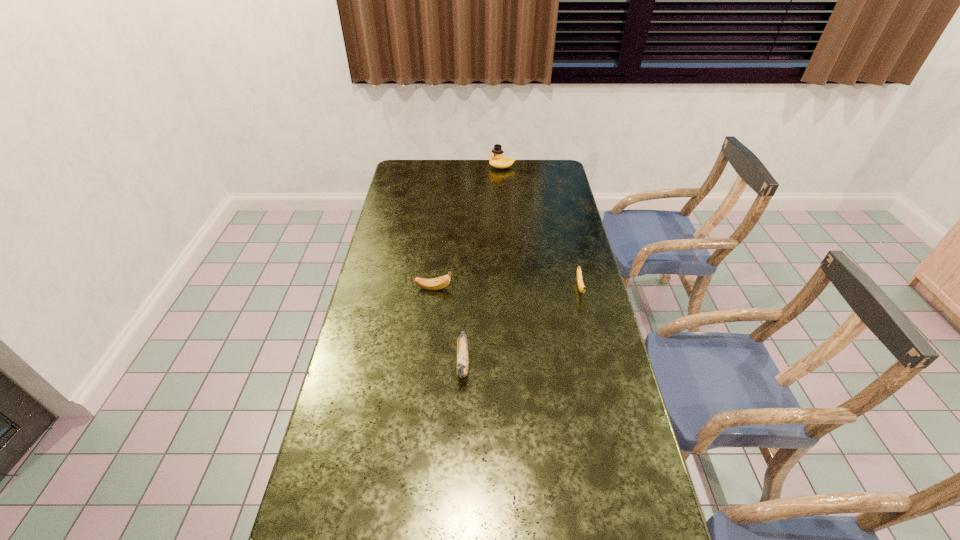
Where is `vacant space located on the front-facing side of the tallest object`? vacant space located on the front-facing side of the tallest object is located at coordinates (406, 167).

Image resolution: width=960 pixels, height=540 pixels. I want to click on vacant space located 0.310m on the peel of the nearest banana, so click(x=458, y=503).

Locate an element on the screen. The image size is (960, 540). vacant space positioned 0.110m on the right of the second tallest banana is located at coordinates pos(484,288).

You are a GUI agent. You are given a task and a screenshot of the screen. Output one action in this format:
    pyautogui.click(x=<x>, y=<y>)
    Task: Click on the free space located 0.180m at the stem of the shortest object
    
    Given the screenshot: What is the action you would take?
    pyautogui.click(x=592, y=342)

Where is `object located in the far edge section of the desktop`? This screenshot has height=540, width=960. object located in the far edge section of the desktop is located at coordinates click(498, 160).

Find the location of a particular element. object located in the right edge section of the desktop is located at coordinates (x=581, y=287).

This screenshot has height=540, width=960. In the image, there is a desktop. What are the coordinates of `vacant space at the left edge` in the screenshot? It's located at (417, 218).

Identify the location of free spot at the right edge of the desktop. click(548, 248).

In the image, there is a desktop. Identify the location of free space at the far left corner. This screenshot has width=960, height=540. (404, 164).

This screenshot has width=960, height=540. Find the location of `free space between the leftmost banana and the nearest object`. free space between the leftmost banana and the nearest object is located at coordinates (448, 325).